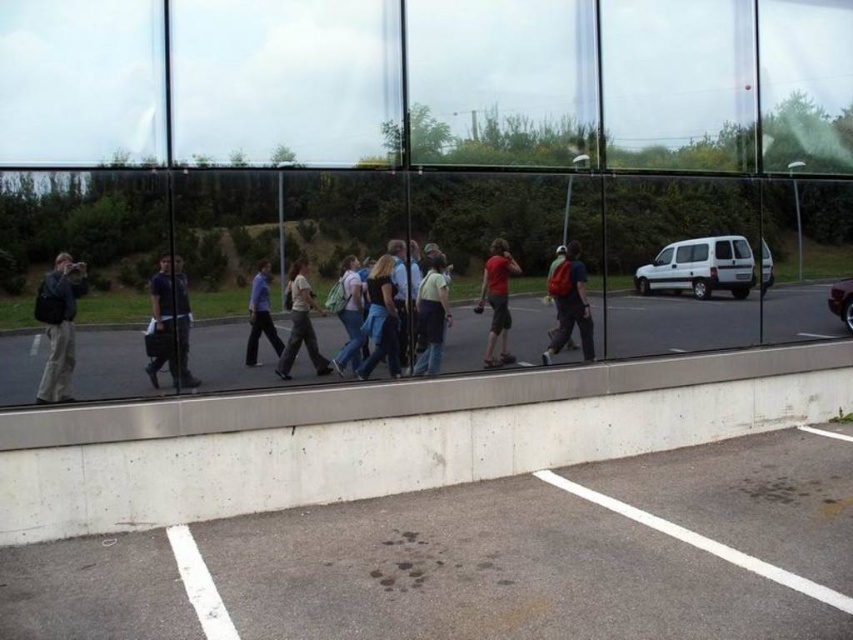
Between point (303, 337) and point (834, 314), which one is positioned behind?

Positioned behind is point (834, 314).

Can you confirm if light brown fabric pants at center is smaller than shiny metallic car at right?

Actually, light brown fabric pants at center might be larger than shiny metallic car at right.

Is point (287, 301) closer to viewer compared to point (846, 300)?

Yes, it is in front of point (846, 300).

I want to click on light brown fabric pants at center, so click(x=299, y=323).

Who is positioned more to the right, white matte van at right or matte red backpack at center?

From the viewer's perspective, white matte van at right appears more on the right side.

Consider the image. Which of these two, white matte van at right or matte red backpack at center, stands shorter?

white matte van at right

Is point (645, 268) in front of point (564, 294)?

No, (645, 268) is further to viewer.

This screenshot has width=853, height=640. In order to click on white matte van at right in this screenshot , I will do `click(699, 268)`.

Is matte red backpack at center positioned at the back of light blue denim jeans at center?

That is True.

Which is below, matte red backpack at center or light blue denim jeans at center?

light blue denim jeans at center is lower down.

Is point (556, 266) closer to viewer compared to point (357, 328)?

No, it is not.

You are a GUI agent. You are given a task and a screenshot of the screen. Output one action in this format:
    pyautogui.click(x=<x>, y=<y>)
    Task: Click on the matte red backpack at center
    
    Given the screenshot: What is the action you would take?
    pyautogui.click(x=570, y=305)